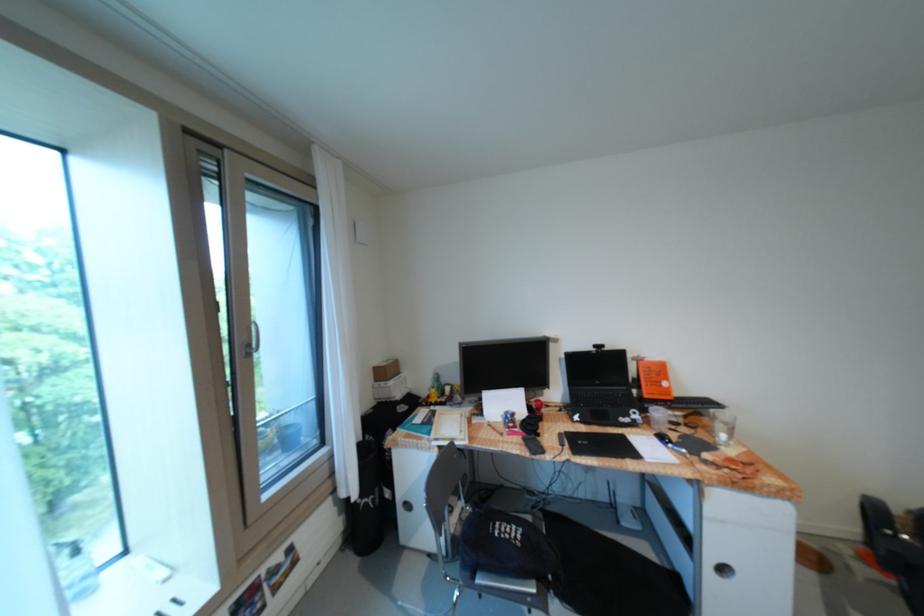
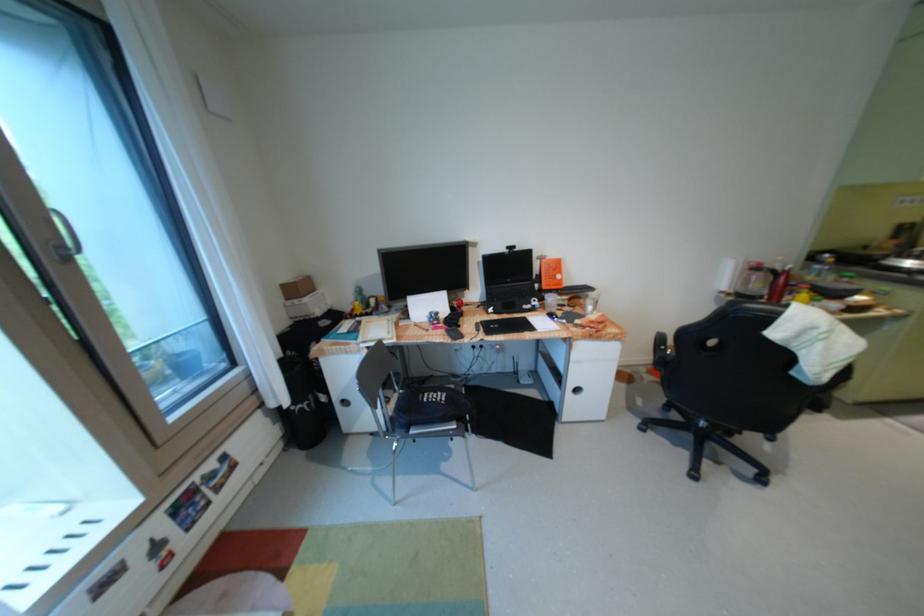
In the second image, find the point that corresponds to [260,346] in the first image.

(73, 248)